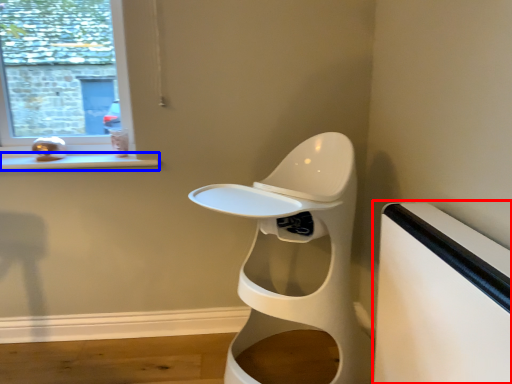
Question: Which of the following is the closest to the observer, table (highlighted by a red box) or window sill (highlighted by a blue box)?

Choices:
 (A) table
 (B) window sill

Answer: (A)